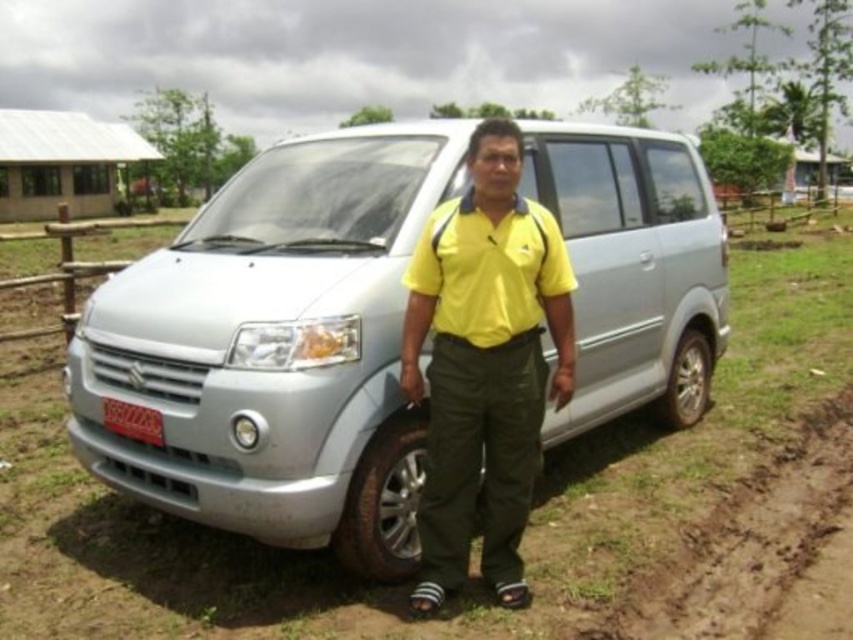
Question: Can you confirm if silver metallic van at center is thinner than black rubber tire at lower center?

Choices:
 (A) yes
 (B) no

Answer: (B)

Question: Which of the following is the closest to the observer?

Choices:
 (A) (405, 445)
 (B) (697, 616)
 (C) (680, 396)
 (D) (517, 145)

Answer: (D)

Question: Among these objects, which one is farthest from the camera?

Choices:
 (A) silver metallic tire at lower right
 (B) brown muddy dirt track at lower right
 (C) silver metallic van at center
 (D) black rubber tire at lower center

Answer: (A)

Question: Estimate the real-world distances between objects in this image. Which object is farther from the brown muddy dirt track at lower right?

Choices:
 (A) yellow matte shirt at center
 (B) silver metallic van at center
 (C) black rubber tire at lower center

Answer: (B)

Question: Does silver metallic van at center come behind yellow matte shirt at center?

Choices:
 (A) no
 (B) yes

Answer: (A)

Question: Is yellow matte shirt at center behind brown muddy dirt track at lower right?

Choices:
 (A) yes
 (B) no

Answer: (A)